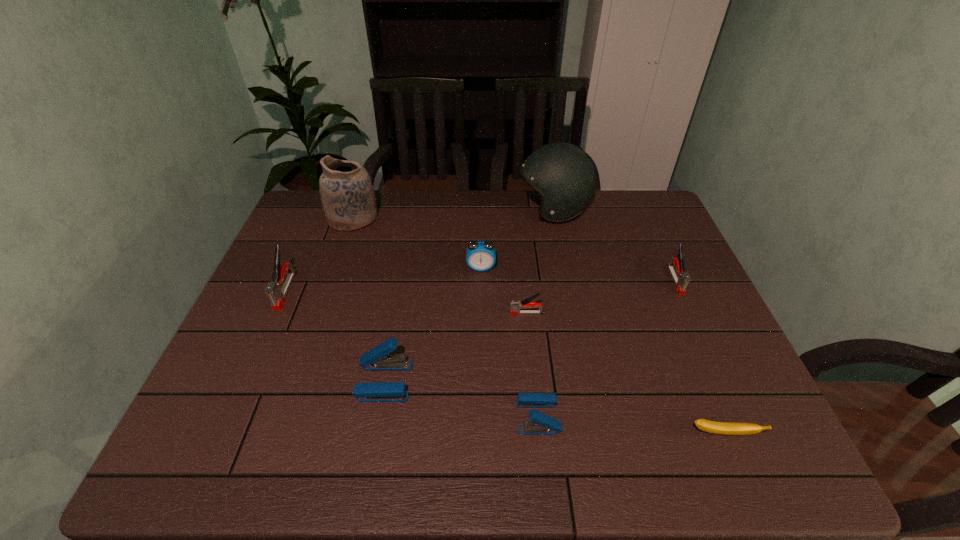
This screenshot has height=540, width=960. In order to click on free space at the right edge of the desktop in this screenshot , I will do pos(684,373).

Locate an element on the screen. The height and width of the screenshot is (540, 960). blank space at the near left corner of the desktop is located at coordinates (252, 455).

In the image, there is a desktop. Where is `vacant region at the far right corner`? vacant region at the far right corner is located at coordinates (623, 199).

Identify the location of vacant space at the near right corner of the desktop. (774, 458).

Identify the location of vacant area that lies between the pottery and the smaller blue stapler. (445, 317).

In order to click on free space that is in between the green football helmet and the yellow banana in this screenshot , I will do `click(638, 321)`.

At what (x,y) coordinates should I click in order to perform the action: click on free space between the leftmost object and the green football helmet. Please return your answer as a coordinate pair (x, y). The image size is (960, 540). Looking at the image, I should click on (420, 250).

At what (x,y) coordinates should I click in order to perform the action: click on free space between the left blue stapler and the eighth object from right to left. Please return your answer as a coordinate pair (x, y). Looking at the image, I should click on (369, 299).

I want to click on free space between the second biggest gray stapler and the tallest stapler, so click(480, 285).

At what (x,y) coordinates should I click in order to perform the action: click on empty location between the seventh shortest object and the second object from left to right. Please return your answer as a coordinate pair (x, y). The image size is (960, 540). Looking at the image, I should click on (320, 254).